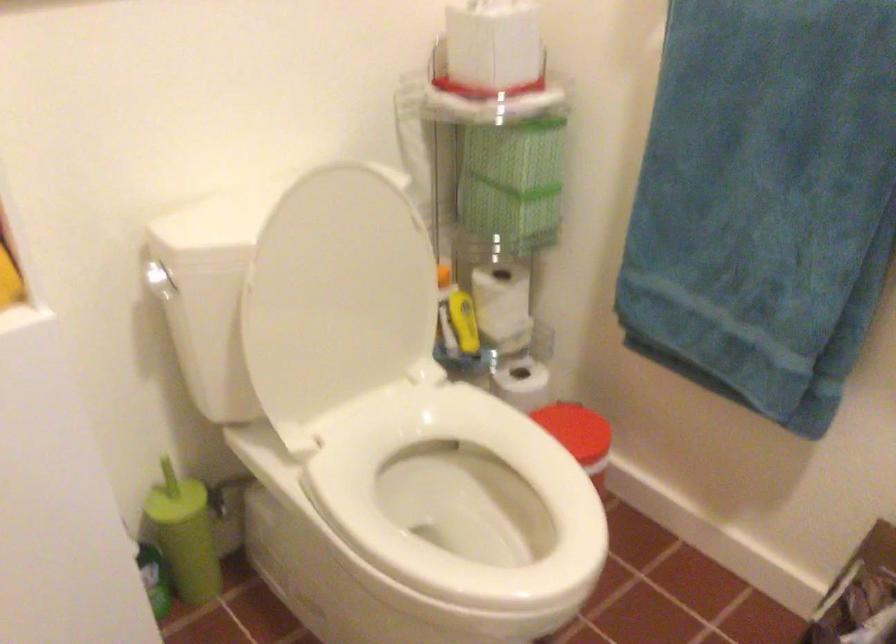
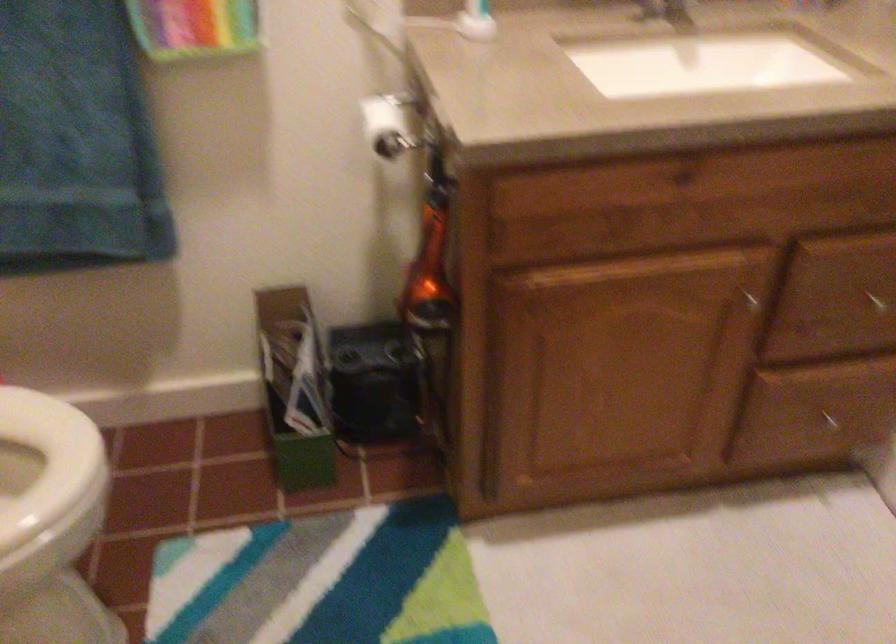
In the second image, find the point that corresponds to (x=547, y=544) in the first image.

(47, 466)